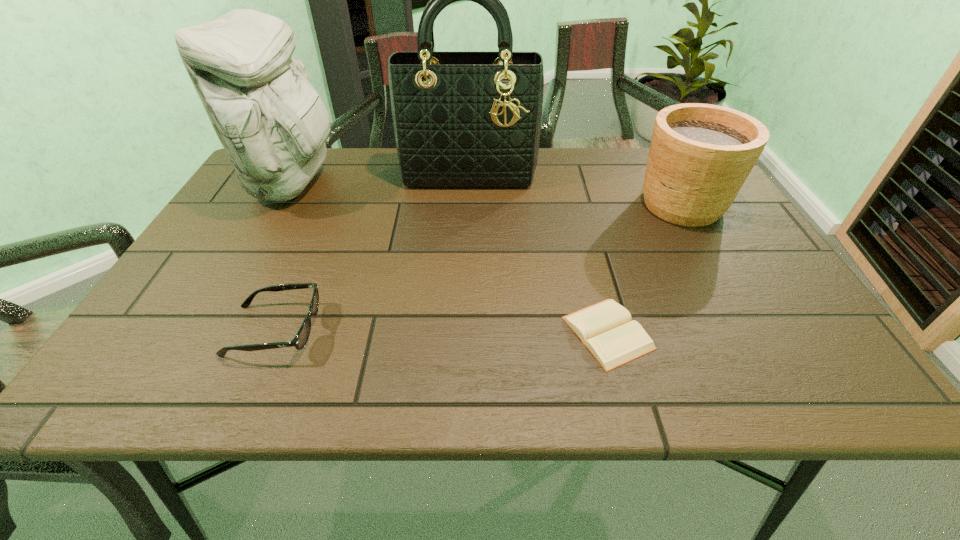
Locate an element on the screen. Image resolution: width=960 pixels, height=540 pixels. free spot between the fourth tallest object and the handbag is located at coordinates (372, 252).

The image size is (960, 540). I want to click on vacant space that's between the second shortest object and the shortest object, so click(441, 332).

The width and height of the screenshot is (960, 540). Find the location of `vacant area that lies between the third shortest object and the spectacles`. vacant area that lies between the third shortest object and the spectacles is located at coordinates (478, 267).

The width and height of the screenshot is (960, 540). In order to click on free spot between the fourth object from left to right and the rightmost object in this screenshot , I will do `click(645, 268)`.

Locate an element on the screen. unoccupied area between the fourth tallest object and the diary is located at coordinates [441, 332].

Identify the location of object that stands as the second closest to the backpack. (299, 341).

This screenshot has height=540, width=960. In order to click on the fourth closest object to the third object from left to right in this screenshot , I will do `click(299, 341)`.

Locate an element on the screen. The width and height of the screenshot is (960, 540). free region that satisfies the following two spatial constraints: 1. at the front of the handbag with visible charms; 2. on the left side of the third shortest object is located at coordinates tap(468, 204).

Locate an element on the screen. free spot that satisfies the following two spatial constraints: 1. on the lenses of the spectacles; 2. on the left side of the fourth object from left to right is located at coordinates (273, 333).

Locate an element on the screen. This screenshot has width=960, height=540. free space that satisfies the following two spatial constraints: 1. on the lenses of the fourth object from left to right; 2. on the left side of the spectacles is located at coordinates (273, 333).